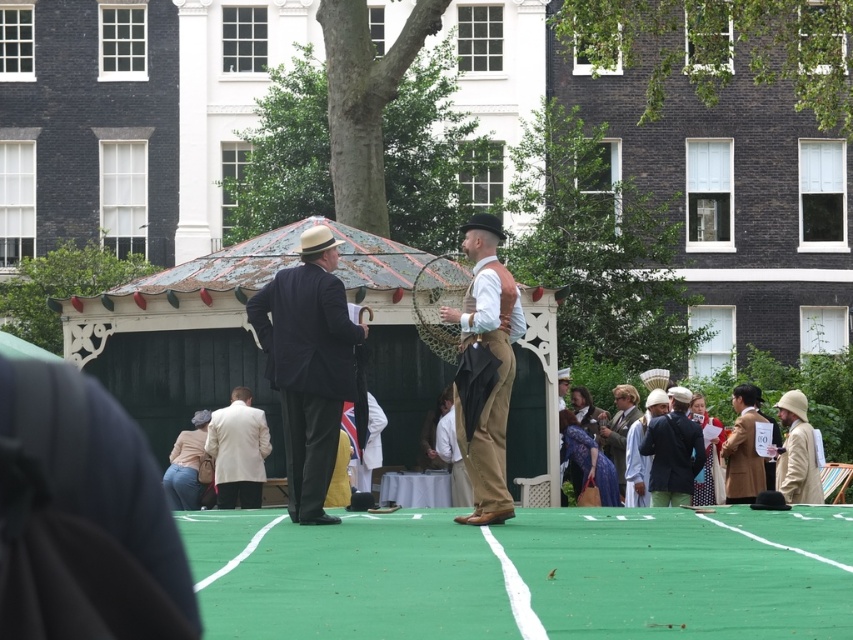
Question: Does dark blue suit at center have a greater width compared to brown leather vest at center?

Choices:
 (A) no
 (B) yes

Answer: (B)

Question: Which of the following is the closest to the observer?

Choices:
 (A) (726, 438)
 (B) (241, 488)
 (C) (520, 312)
 (D) (270, 324)

Answer: (C)

Question: Can you confirm if dark blue suit at center is positioned above light brown fabric hat at right?

Choices:
 (A) yes
 (B) no

Answer: (A)

Question: Among these points, which one is farthest from the camera?

Choices:
 (A) (465, 250)
 (B) (779, 436)
 (C) (320, 328)
 (D) (216, 500)

Answer: (B)

Question: Which of the following is the farthest from the observer?

Choices:
 (A) dark blue suit at center
 (B) brown leather vest at center
 (C) light brown fabric hat at right

Answer: (C)

Question: Does dark blue suit at center appear over light beige fabric coat at center?

Choices:
 (A) yes
 (B) no

Answer: (A)